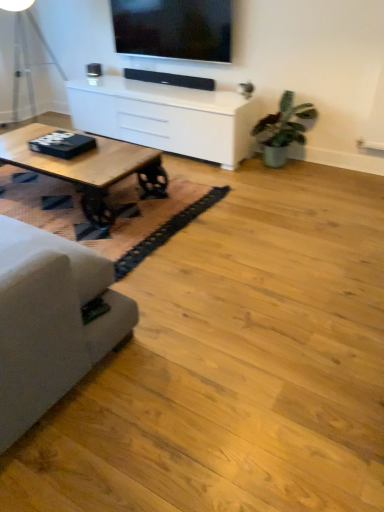
Where is `vacant area on top of white glossy cabinet at upper center (from a real-world perspective)`? The image size is (384, 512). vacant area on top of white glossy cabinet at upper center (from a real-world perspective) is located at coordinates (164, 84).